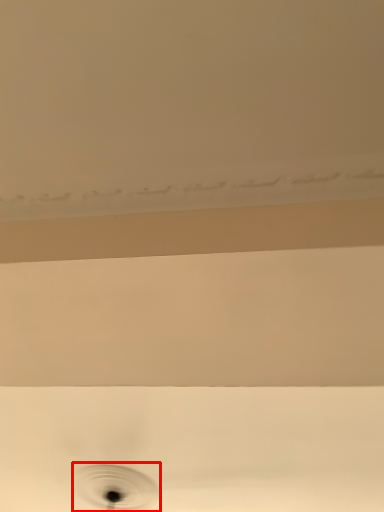
Question: Observing the image, what is the correct spatial positioning of hole (annotated by the red box) in reference to plumbing fixture?

Choices:
 (A) right
 (B) left

Answer: (B)